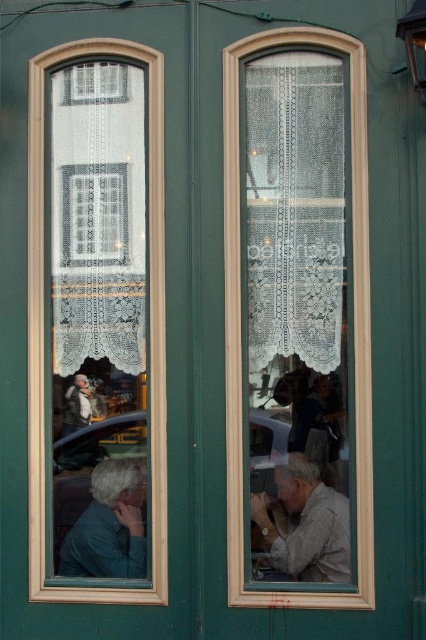
You are a tailor observing two jackets displayed in a store window. The jackets are the dark blue fabric jacket at lower left and the light brown leather jacket at left. Which jacket appears taller when viewed from the outside of the store?

The dark blue fabric jacket at lower left appears taller than the light brown leather jacket at left when viewed from the outside of the store.

You are a delivery person trying to slide a small package through the clear glass window at left to the dark blue fabric jacket at lower left. The package is 7 inches long. Can you fit the package through the space between them?

The distance between the clear glass window at left and the dark blue fabric jacket at lower left is 6.65 inches. Since the package is 7 inches long, it is slightly longer than the available space, so the package cannot fit through the space between them.